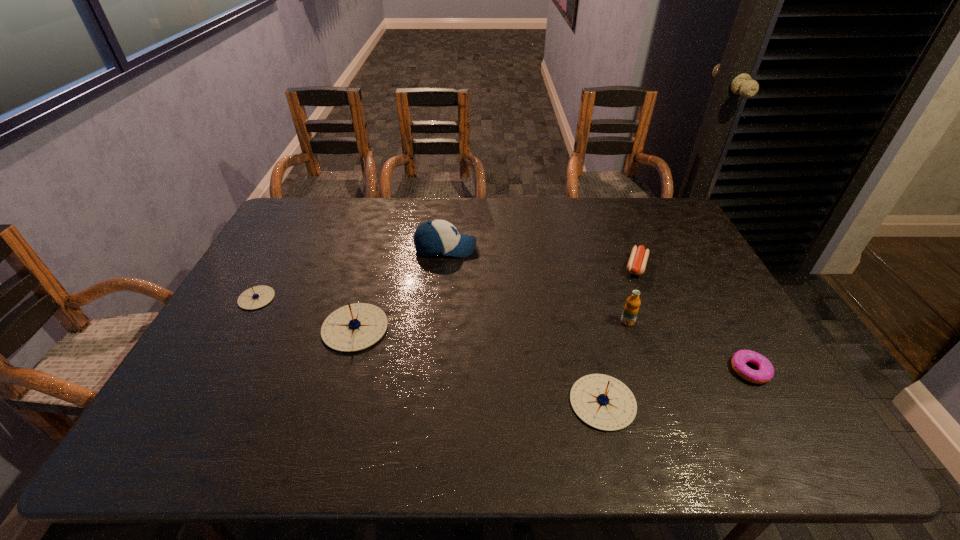
Locate which compass is the second closest to the third object from right to left. Please provide its 2D coordinates. Your answer should be formatted as a tuple, i.e. [(x, y)], where the tuple contains the x and y coordinates of a point satisfying the conditions above.

[(354, 327)]

The height and width of the screenshot is (540, 960). Identify the location of compass identified as the third closest to the second object from right to left. (256, 297).

The image size is (960, 540). Identify the location of free space that satisfies the following two spatial constraints: 1. on the back side of the second shortest compass; 2. on the right side of the sausage. (570, 266).

You are a GUI agent. You are given a task and a screenshot of the screen. Output one action in this format:
    pyautogui.click(x=<x>, y=<y>)
    Task: Click on the free region that satisfies the following two spatial constraints: 1. on the front-facing side of the third object from left to right; 2. on the right side of the rightmost compass
    This screenshot has width=960, height=540.
    Given the screenshot: What is the action you would take?
    pyautogui.click(x=431, y=402)

Locate an element on the screen. The width and height of the screenshot is (960, 540). free spot that satisfies the following two spatial constraints: 1. on the front-facing side of the rightmost compass; 2. on the right side of the baseball cap is located at coordinates (431, 402).

Locate an element on the screen. Image resolution: width=960 pixels, height=540 pixels. vacant space that satisfies the following two spatial constraints: 1. on the back side of the nearest compass; 2. on the left side of the rightmost object is located at coordinates (595, 370).

Image resolution: width=960 pixels, height=540 pixels. I want to click on vacant region that satisfies the following two spatial constraints: 1. on the front side of the second object from left to right; 2. on the right side of the nearest compass, so click(x=334, y=402).